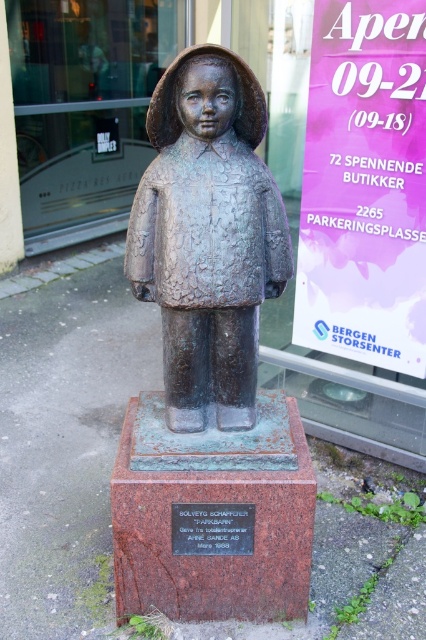
You are an art student analyzing the sculpture and its pedestal. You notice both the bronze statue at center and the bronze plaque at center. Which object takes up more space in the composition?

The bronze statue at center is larger in size than the bronze plaque at center, so it takes up more space in the composition.

What is the spatial relationship between the bronze statue at center and the bronze plaque at center?

The bronze statue at center is located above the bronze plaque at center.

You are an art student analyzing the statue and its pedestal. You notice both the bronze statue at center and the bronze plaque at center. Which object is positioned closer to you?

The bronze statue at center is closer to the viewer than the bronze plaque at center, so the bronze statue at center is positioned closer to you.